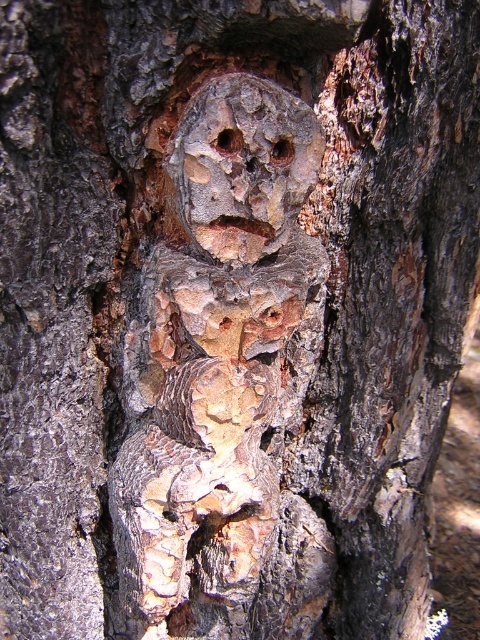
Does rustic bark face at upper center appear under smooth wood hole at center?

Yes.

Does rustic bark face at upper center appear over smooth wood hole at center?

No, rustic bark face at upper center is not above smooth wood hole at center.

Measure the distance between rustic bark face at upper center and camera.

rustic bark face at upper center is 17.77 inches away from camera.

Where is `rustic bark face at upper center`? rustic bark face at upper center is located at coordinates (242, 166).

Between brown rough bark hole at center and smooth wood hole at center, which one appears on the left side from the viewer's perspective?

Positioned to the left is brown rough bark hole at center.

Is brown rough bark hole at center smaller than smooth wood hole at center?

Indeed, brown rough bark hole at center has a smaller size compared to smooth wood hole at center.

The height and width of the screenshot is (640, 480). In order to click on brown rough bark hole at center in this screenshot , I will do `click(228, 141)`.

Who is more forward, (227, 97) or (240, 141)?

Point (227, 97) is more forward.

Can you confirm if rustic bark face at upper center is positioned above brown rough bark hole at center?

No.

Is point (197, 188) closer to camera compared to point (219, 141)?

No, it is behind (219, 141).

The height and width of the screenshot is (640, 480). In order to click on rustic bark face at upper center in this screenshot , I will do `click(242, 166)`.